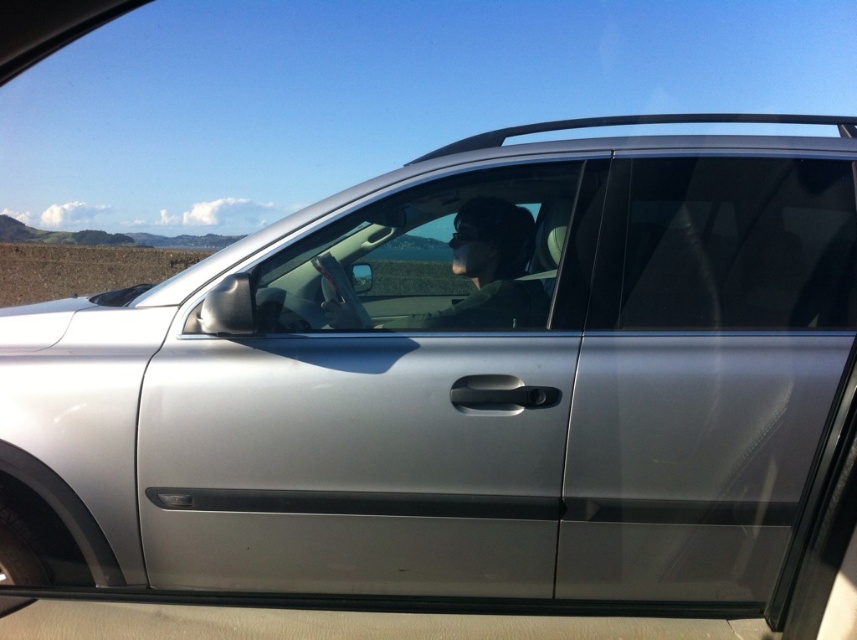
Between point (564, 356) and point (534, 300), which one is positioned behind?

The point (534, 300) is more distant.

You are a GUI agent. You are given a task and a screenshot of the screen. Output one action in this format:
    pyautogui.click(x=<x>, y=<y>)
    Task: Click on the silver metallic car door at center
    
    Given the screenshot: What is the action you would take?
    pyautogui.click(x=376, y=397)

You are a GUI agent. You are given a task and a screenshot of the screen. Output one action in this format:
    pyautogui.click(x=<x>, y=<y>)
    Task: Click on the silver metallic car door at center
    The width and height of the screenshot is (857, 640).
    Given the screenshot: What is the action you would take?
    pyautogui.click(x=376, y=397)

Between silver metallic car door at center and clear glass window at center, which one has less height?

With less height is clear glass window at center.

This screenshot has height=640, width=857. What do you see at coordinates (376, 397) in the screenshot? I see `silver metallic car door at center` at bounding box center [376, 397].

Locate an element on the screen. Image resolution: width=857 pixels, height=640 pixels. silver metallic car door at center is located at coordinates (376, 397).

Can you confirm if clear glass window at center is positioned below matte black hair at center?

Yes, clear glass window at center is below matte black hair at center.

Between point (541, 262) and point (466, 204), which one is positioned behind?

The point (466, 204) is more distant.

What are the coordinates of `clear glass window at center` in the screenshot? It's located at (415, 260).